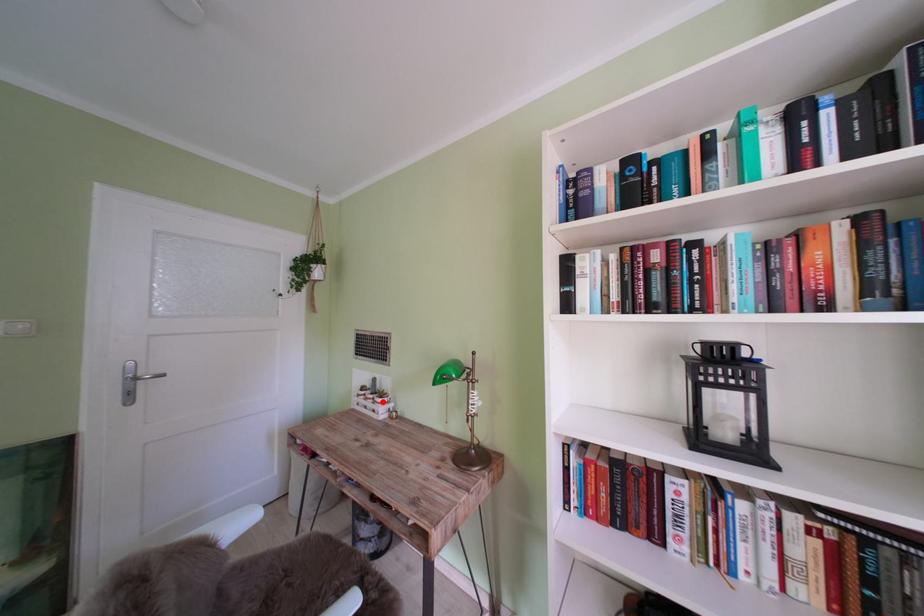
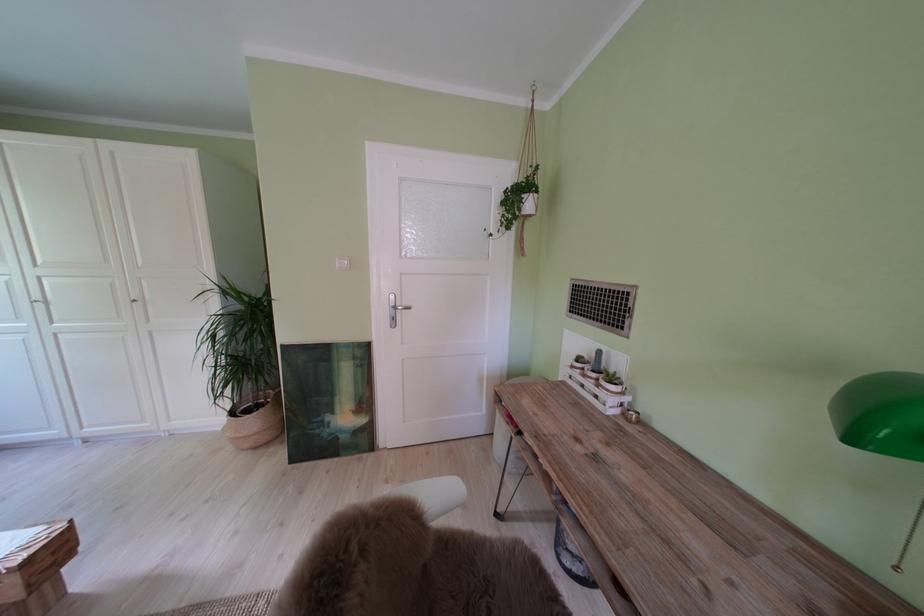
Question: I am providing you with two images of the same scene from different viewpoints. Given a red point in image1, look at the same physical point in image2. Is it:

Choices:
 (A) Closer to the viewpoint
 (B) Farther from the viewpoint

Answer: (A)